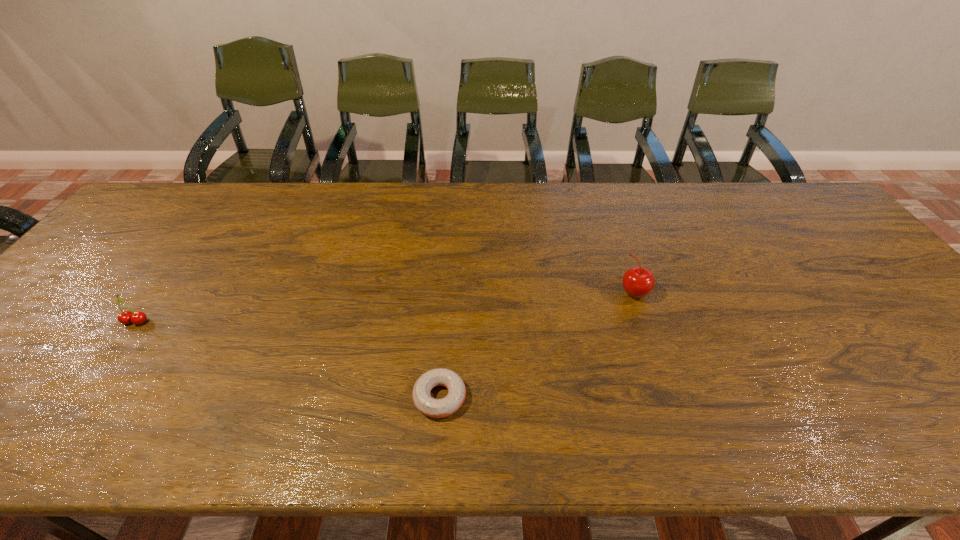
Locate an element on the screen. the right cherry is located at coordinates (638, 282).

Identify the location of the farthest object. 638,282.

Locate an element on the screen. the second nearest object is located at coordinates (126, 317).

This screenshot has width=960, height=540. Identify the location of the nearer cherry. tap(126, 317).

Find the location of a particular element. doughnut is located at coordinates (435, 408).

Image resolution: width=960 pixels, height=540 pixels. What are the coordinates of `the nearest object` in the screenshot? It's located at (435, 408).

This screenshot has width=960, height=540. I want to click on free spot located 0.320m on the front of the farthest object, so click(679, 420).

Identify the location of free spot located with the stems of the shorter cherry pointing upwards. Image resolution: width=960 pixels, height=540 pixels. (87, 388).

You are a GUI agent. You are given a task and a screenshot of the screen. Output one action in this format:
    pyautogui.click(x=<x>, y=<y>)
    Task: Click on the vacant space located 0.080m on the back of the doughnut
    The width and height of the screenshot is (960, 540).
    Given the screenshot: What is the action you would take?
    pyautogui.click(x=444, y=346)

The image size is (960, 540). What are the coordinates of `object at the near edge` in the screenshot? It's located at (435, 408).